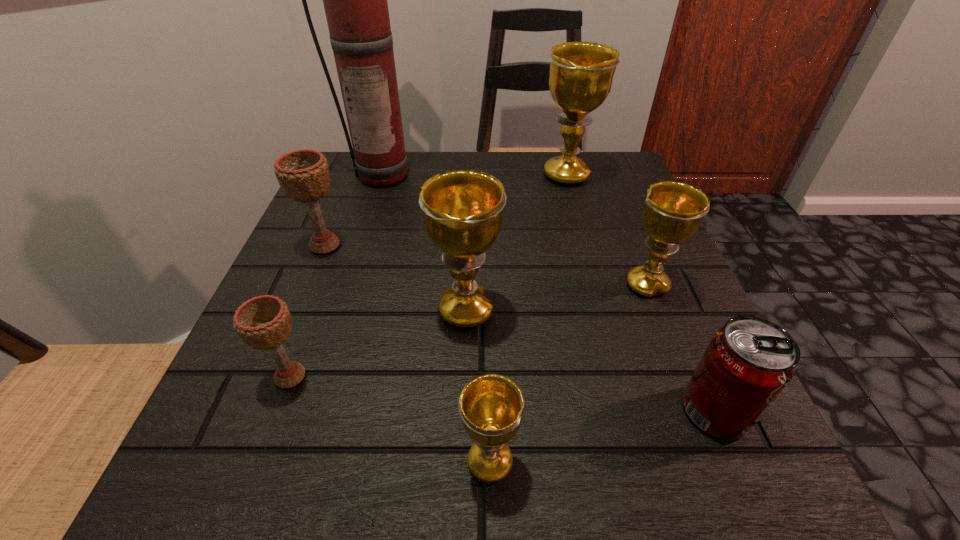
In order to click on vacant area located on the right of the nearer beige chalice in this screenshot , I will do `click(482, 376)`.

The height and width of the screenshot is (540, 960). I want to click on vacant space situated on the left of the nearest chalice, so click(x=379, y=462).

What are the coordinates of `fire extinguisher at the far edge` in the screenshot? It's located at (355, 0).

Find the location of a particular element. The height and width of the screenshot is (540, 960). chalice that is positioned at the far edge is located at coordinates (581, 74).

The width and height of the screenshot is (960, 540). I want to click on pop soda present at the near edge, so click(x=748, y=363).

I want to click on chalice that is at the near edge, so click(x=491, y=406).

This screenshot has width=960, height=540. Identify the location of fire extinguisher that is positioned at the left edge. (355, 0).

I want to click on pop soda that is at the right edge, so click(748, 363).

This screenshot has width=960, height=540. Identify the location of object that is positioned at the far left corner. (355, 0).

You are a GUI agent. You are given a task and a screenshot of the screen. Output one action in this format:
    pyautogui.click(x=<x>, y=<y>)
    Task: Click on the object located at the far right corner
    This screenshot has height=540, width=960.
    Given the screenshot: What is the action you would take?
    (x=581, y=74)